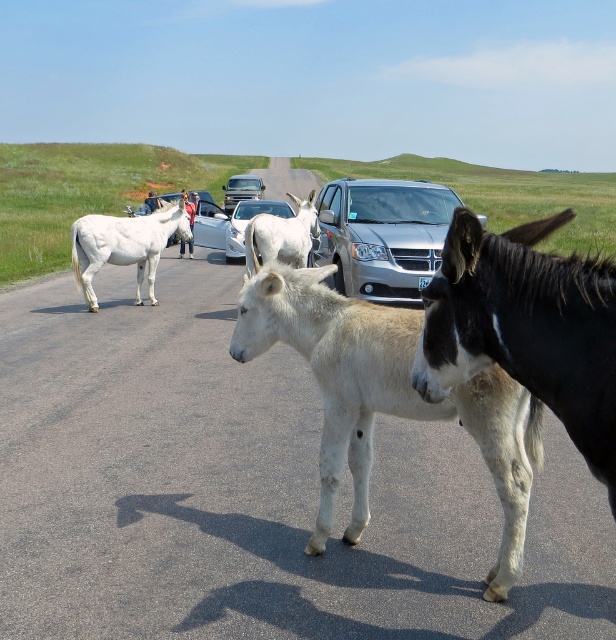
You are a photographer standing at the edge of the road, trying to capture a photo of the two points mentioned in the scene. Which point, point [472,371] or point [137,285], will appear larger in your camera view?

Point [472,371] is closer to the camera than point [137,285], so it will appear larger in the camera view.

Based on the photo, you are a delivery driver who needs to pass through the road blocked by the black glossy mule at center and the metallic silver sedan at center. Based on their sizes, which vehicle or animal should you move first to clear the path?

The black glossy mule at center is larger in size than the metallic silver sedan at center, so you should move the black glossy mule at center first to clear the path.